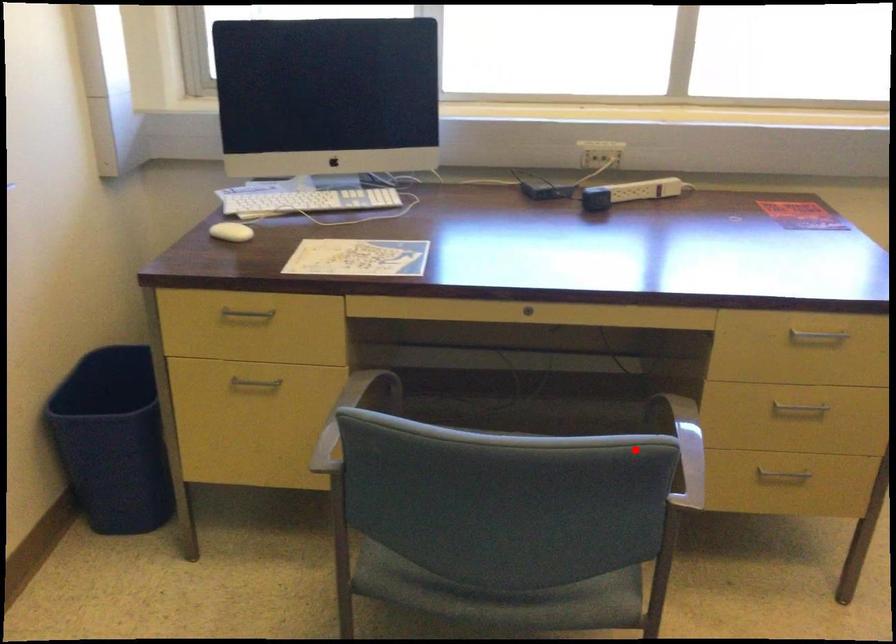
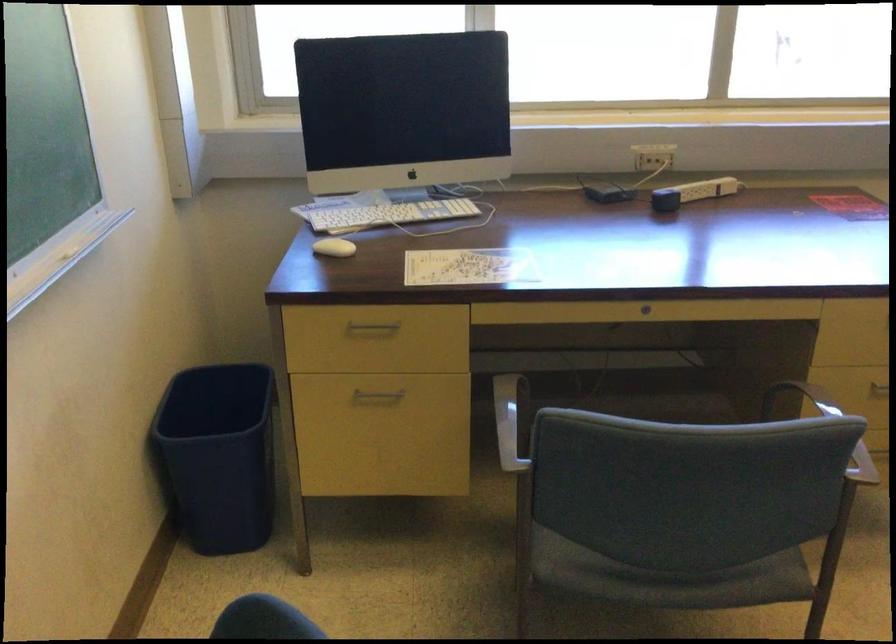
The point at the highlighted location is marked in the first image. Where is the corresponding point in the second image?

(825, 427)